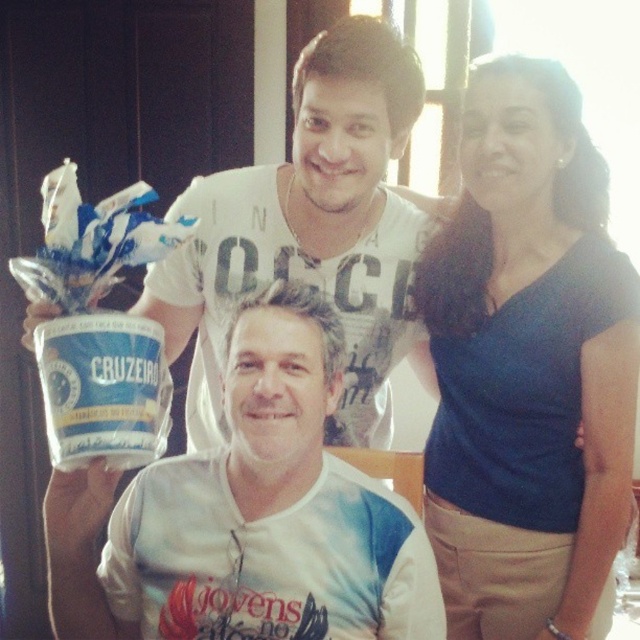
Question: Which is nearer to the white printed t-shirt at center?

Choices:
 (A) blue cotton shirt at upper right
 (B) white matte yogurt at center

Answer: (B)

Question: Can you confirm if blue cotton shirt at upper right is bigger than white matte yogurt at center?

Choices:
 (A) yes
 (B) no

Answer: (A)

Question: Observing the image, what is the correct spatial positioning of blue cotton shirt at upper right in reference to white printed t-shirt at center?

Choices:
 (A) above
 (B) below

Answer: (A)

Question: Among these objects, which one is nearest to the camera?

Choices:
 (A) white printed t-shirt at center
 (B) blue cotton shirt at upper right

Answer: (A)

Question: Which of the following is the closest to the observer?

Choices:
 (A) blue cotton shirt at upper right
 (B) white matte yogurt at center
 (C) white printed t-shirt at center

Answer: (B)

Question: In this image, where is white printed t-shirt at center located relative to white matte yogurt at center?

Choices:
 (A) above
 (B) below

Answer: (B)